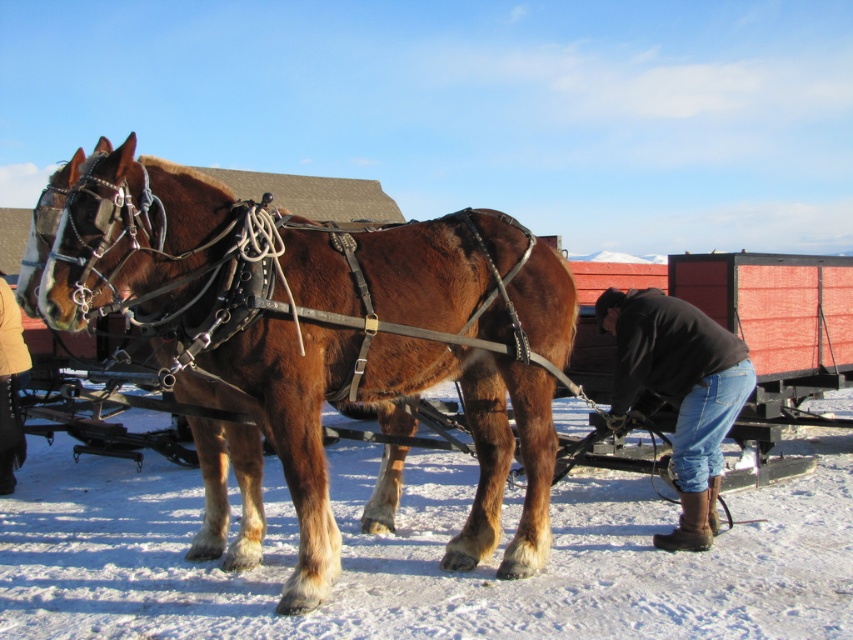
Who is shorter, black leather boots at lower right or yellow leather boots at lower left?

With less height is black leather boots at lower right.

Between black leather boots at lower right and yellow leather boots at lower left, which one appears on the left side from the viewer's perspective?

yellow leather boots at lower left is more to the left.

Is point (688, 384) closer to viewer compared to point (3, 490)?

That is True.

Where is `black leather boots at lower right`? This screenshot has width=853, height=640. black leather boots at lower right is located at coordinates (677, 394).

Between point (497, 312) and point (728, 401), which one is positioned in front?

Point (497, 312)

Does brown leather harness at center have a greater width compared to black leather boots at lower right?

Yes.

This screenshot has width=853, height=640. Describe the element at coordinates (401, 365) in the screenshot. I see `brown leather harness at center` at that location.

Find the location of `brown leather harness at center`. brown leather harness at center is located at coordinates (401, 365).

Who is more forward, (303, 272) or (6, 342)?

Point (303, 272) is more forward.

Does point (73, 234) lie in front of point (0, 385)?

That is True.

Locate an element on the screen. brown leather harness at center is located at coordinates (401, 365).